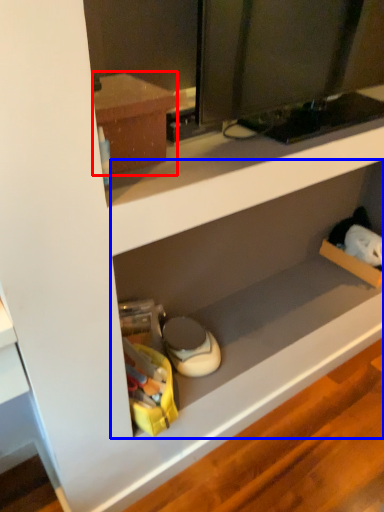
Question: Which of the following is the farthest to the observer, cabinetry (highlighted by a red box) or shelf (highlighted by a blue box)?

Choices:
 (A) cabinetry
 (B) shelf

Answer: (B)